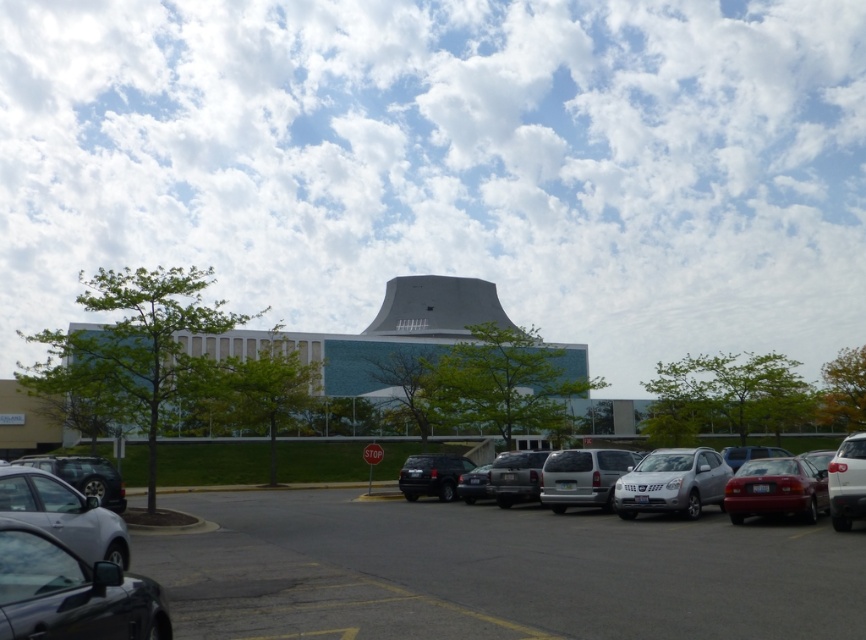
Is point (686, 508) farther from viewer compared to point (618, 460)?

No, it is in front of (618, 460).

Does point (622, 509) come behind point (606, 502)?

No, (622, 509) is in front of (606, 502).

Locate an element on the screen. The image size is (866, 640). satin silver suv at center is located at coordinates (671, 483).

Is shiny red sedan at lower right in front of matte black suv at center?

Yes.

Is point (735, 497) farther from camera compared to point (433, 468)?

No, it is in front of (433, 468).

Where is `shiny red sedan at lower right`? The image size is (866, 640). shiny red sedan at lower right is located at coordinates (774, 490).

Which of these two, silver metallic suv at center or satin silver suv at center, stands shorter?

satin silver suv at center

Can you confirm if silver metallic suv at center is bigger than satin silver suv at center?

Indeed, silver metallic suv at center has a larger size compared to satin silver suv at center.

You are a GUI agent. You are given a task and a screenshot of the screen. Output one action in this format:
    pyautogui.click(x=<x>, y=<y>)
    Task: Click on the silver metallic suv at center
    Image resolution: width=866 pixels, height=640 pixels.
    Given the screenshot: What is the action you would take?
    point(725,483)